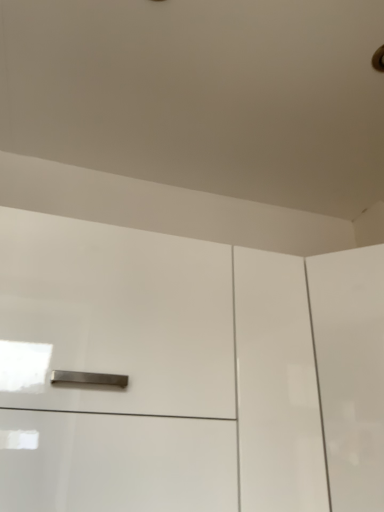
This screenshot has height=512, width=384. Describe the element at coordinates (350, 372) in the screenshot. I see `white glossy cabinet at right` at that location.

Locate an element on the screen. The height and width of the screenshot is (512, 384). white glossy cabinet at right is located at coordinates (350, 372).

At what (x,y) coordinates should I click in order to perform the action: click on glossy white cabinet at center. Please return your answer as a coordinate pair (x, y). Image resolution: width=384 pixels, height=512 pixels. Looking at the image, I should click on (186, 372).

What is the approximate width of glossy white cabinet at center?

The width of glossy white cabinet at center is 17.47 inches.

The height and width of the screenshot is (512, 384). Describe the element at coordinates (186, 372) in the screenshot. I see `glossy white cabinet at center` at that location.

Image resolution: width=384 pixels, height=512 pixels. Identify the location of white glossy cabinet at right. (350, 372).

Would you say white glossy cabinet at right is to the left or to the right of glossy white cabinet at center in the picture?

Based on their positions, white glossy cabinet at right is located to the right of glossy white cabinet at center.

Does white glossy cabinet at right lie in front of glossy white cabinet at center?

No, the depth of white glossy cabinet at right is greater than that of glossy white cabinet at center.

Is point (382, 391) positioned in front of point (176, 425)?

No, it is not.

From the image's perspective, would you say white glossy cabinet at right is shown under glossy white cabinet at center?

Indeed, from the image's perspective, white glossy cabinet at right is shown beneath glossy white cabinet at center.

From a real-world perspective, is white glossy cabinet at right positioned under glossy white cabinet at center based on gravity?

Correct, in the physical world, white glossy cabinet at right is lower than glossy white cabinet at center.

Between white glossy cabinet at right and glossy white cabinet at center, which one has larger width?

With larger width is white glossy cabinet at right.

Is white glossy cabinet at right shorter than glossy white cabinet at center?

Indeed, white glossy cabinet at right has a lesser height compared to glossy white cabinet at center.

Based on the photo, considering the relative sizes of white glossy cabinet at right and glossy white cabinet at center in the image provided, is white glossy cabinet at right bigger than glossy white cabinet at center?

No.

Is white glossy cabinet at right not inside glossy white cabinet at center?

Yes, white glossy cabinet at right is outside of glossy white cabinet at center.

Can you see white glossy cabinet at right touching glossy white cabinet at center?

No, white glossy cabinet at right is not making contact with glossy white cabinet at center.

Could you tell me if white glossy cabinet at right is turned towards glossy white cabinet at center?

No, white glossy cabinet at right is not turned towards glossy white cabinet at center.

How different are the orientations of white glossy cabinet at right and glossy white cabinet at center in degrees?

They differ by 44.6 degrees in their facing directions.

Locate an element on the screen. cabinetry located above the white glossy cabinet at right (from a real-world perspective) is located at coordinates (186, 372).

Is glossy white cabinet at center to the left or to the right of white glossy cabinet at right in the image?

glossy white cabinet at center is positioned on white glossy cabinet at right's left side.

Is glossy white cabinet at center positioned before white glossy cabinet at right?

Yes, it is.

Does point (185, 256) come in front of point (334, 378)?

No, (185, 256) is further to viewer.

From the image's perspective, would you say glossy white cabinet at center is positioned over white glossy cabinet at right?

Yes.

From the picture: From a real-world perspective, which is physically below, glossy white cabinet at center or white glossy cabinet at right?

In real-world perspective, white glossy cabinet at right is lower.

Which object is thinner, glossy white cabinet at center or white glossy cabinet at right?

Thinner between the two is glossy white cabinet at center.

Can you confirm if glossy white cabinet at center is taller than white glossy cabinet at right?

Indeed, glossy white cabinet at center has a greater height compared to white glossy cabinet at right.

Does glossy white cabinet at center have a larger size compared to white glossy cabinet at right?

Correct, glossy white cabinet at center is larger in size than white glossy cabinet at right.

Is glossy white cabinet at center located outside white glossy cabinet at right?

Yes, glossy white cabinet at center is outside of white glossy cabinet at right.

Is glossy white cabinet at center beside white glossy cabinet at right?

No, glossy white cabinet at center is not making contact with white glossy cabinet at right.

Could you tell me if glossy white cabinet at center is turned towards white glossy cabinet at right?

No, glossy white cabinet at center does not turn towards white glossy cabinet at right.

In the scene shown: What's the angular difference between glossy white cabinet at center and white glossy cabinet at right's facing directions?

The angular difference between glossy white cabinet at center and white glossy cabinet at right is 44.6 degrees.

Find the location of a particular element. The height and width of the screenshot is (512, 384). screen door below the glossy white cabinet at center (from a real-world perspective) is located at coordinates (350, 372).

Locate an element on the screen. The width and height of the screenshot is (384, 512). screen door below the glossy white cabinet at center (from the image's perspective) is located at coordinates (350, 372).

You are a GUI agent. You are given a task and a screenshot of the screen. Output one action in this format:
    pyautogui.click(x=<x>, y=<y>)
    Task: Click on the cabinetry above the white glossy cabinet at right (from a real-world perspective)
    
    Given the screenshot: What is the action you would take?
    pyautogui.click(x=186, y=372)